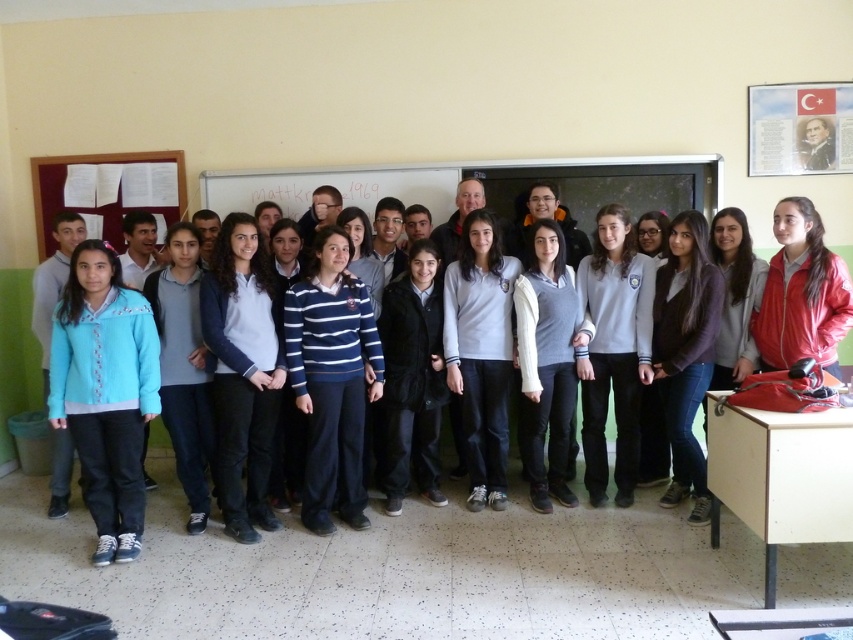
Please look at the image. There is a point at coordinates (331, 380). What object is located exactly at that point?

The blue striped sweater at center is located exactly at point (331, 380).

In the classroom scene, there are two students wearing a blue striped sweater at center and a gray wool sweater at center. Which student is positioned to the left?

The blue striped sweater at center is positioned to the left of the gray wool sweater at center.

In the scene shown: You are a photographer taking a group photo of the students in the classroom. You notice the blue striped sweater at center and the gray wool sweater at center. Which sweater is positioned lower in the image?

The blue striped sweater at center is located below the gray wool sweater at center, so it is positioned lower in the image.